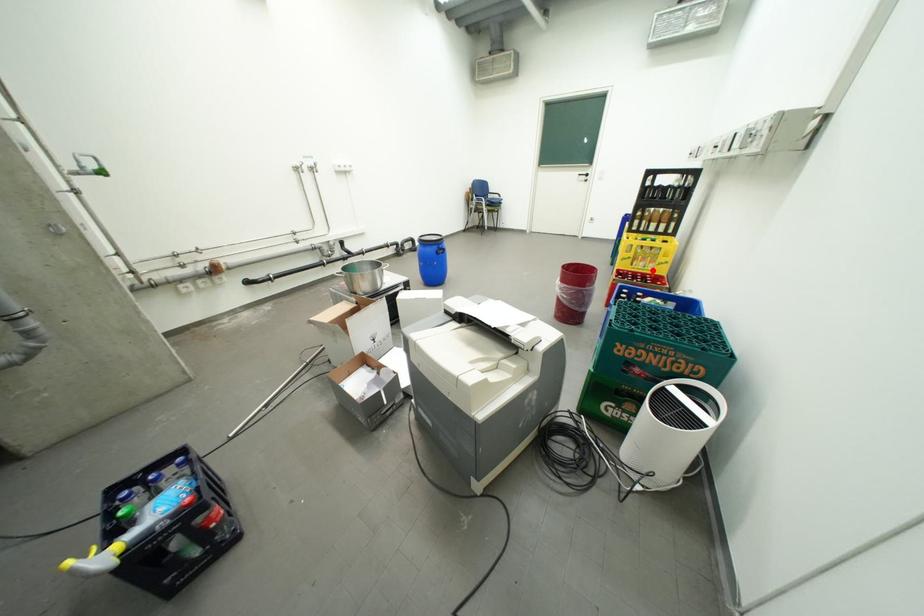
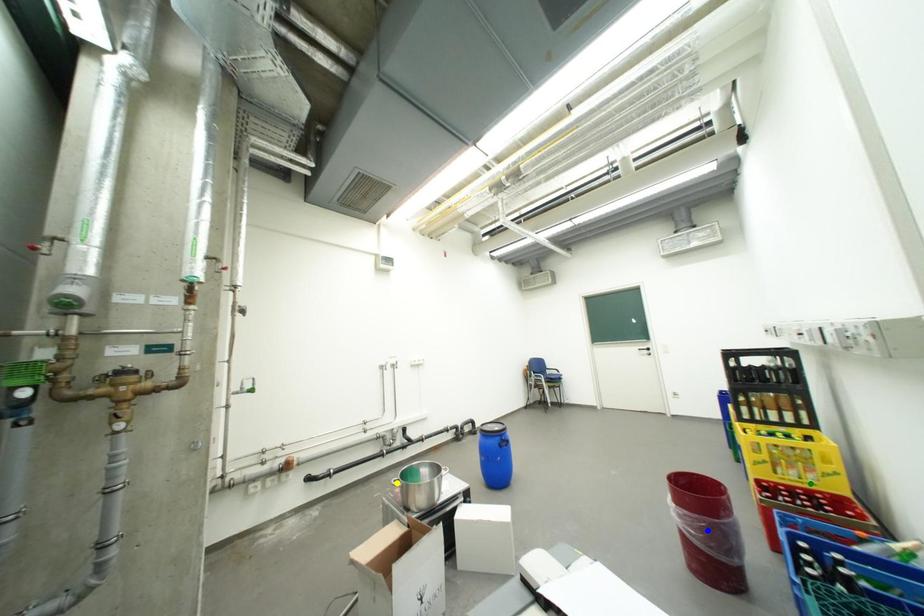
Question: I am providing you with two images of the same scene from different viewpoints. A red point is marked on the first image. You are given multiple points on the second image. In image 2, which mark is for the same physical point as the one in image 1?

Choices:
 (A) green point
 (B) yellow point
 (C) blue point

Answer: (A)